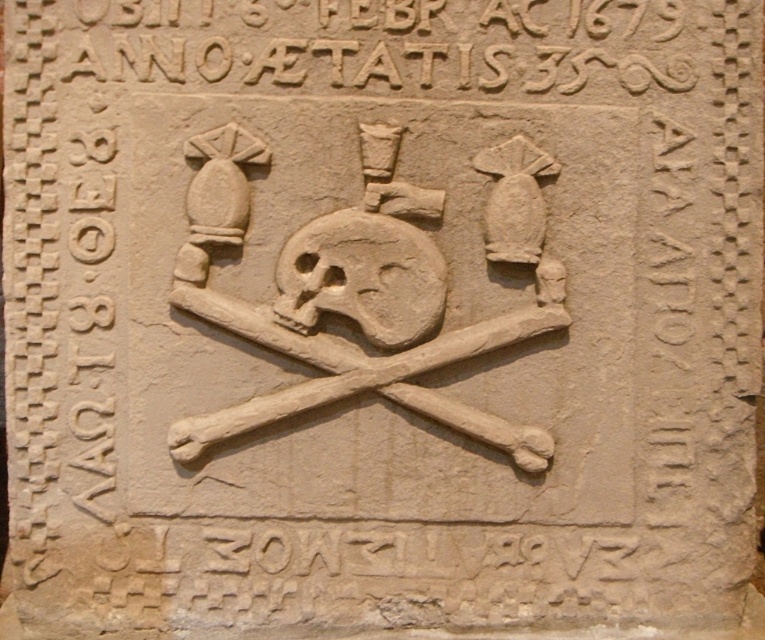
Which of these two, carved stone bones at center or beige stone skull at center, stands shorter?

With less height is beige stone skull at center.

Does carved stone bones at center appear on the right side of beige stone skull at center?

Correct, you'll find carved stone bones at center to the right of beige stone skull at center.

Locate an element on the screen. carved stone bones at center is located at coordinates (363, 376).